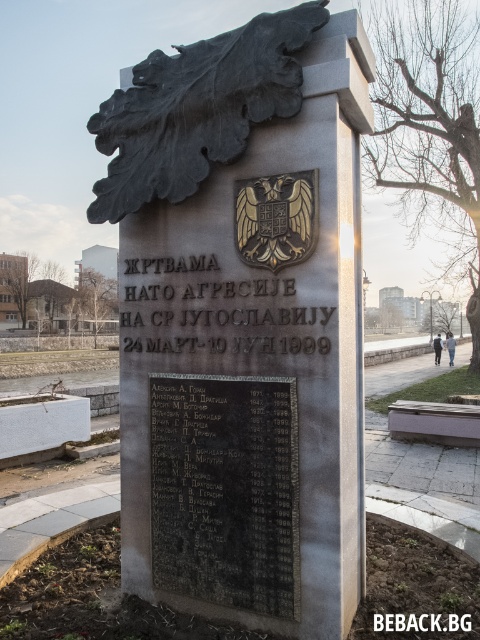
Question: Which object appears closest to the camera in this image?

Choices:
 (A) black granite monument at center
 (B) black stone plaque at center
 (C) matte black jacket at center

Answer: (A)

Question: Which object is positioned closest to the matte black jacket at center?

Choices:
 (A) black leather jacket at center
 (B) black granite monument at center
 (C) black stone plaque at center

Answer: (A)

Question: Can you confirm if black granite monument at center is positioned to the right of black leather jacket at center?

Choices:
 (A) no
 (B) yes

Answer: (A)

Question: Is matte black jacket at center below black leather jacket at center?

Choices:
 (A) no
 (B) yes

Answer: (A)

Question: Among these objects, which one is nearest to the camera?

Choices:
 (A) black leather jacket at center
 (B) matte black jacket at center
 (C) black granite monument at center

Answer: (C)

Question: Is black granite monument at center thinner than matte black jacket at center?

Choices:
 (A) no
 (B) yes

Answer: (A)